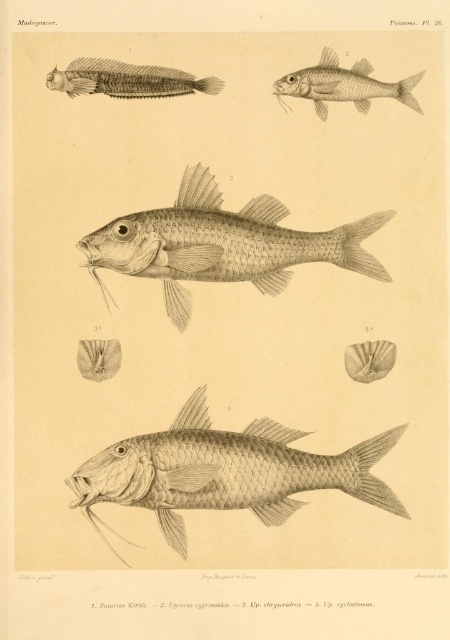
Question: Does grayish matte fish at center appear on the right side of grayish-silver fish at upper left?

Choices:
 (A) yes
 (B) no

Answer: (A)

Question: Which is farther from the grayish-silver fish at upper left?

Choices:
 (A) grayish matte fish at center
 (B) gray textured fish at center
 (C) grayish silver fish at upper center

Answer: (B)

Question: Which of these objects is positioned closest to the grayish silver fish at upper center?

Choices:
 (A) grayish-silver fish at upper left
 (B) grayish matte fish at center
 (C) gray textured fish at center

Answer: (A)

Question: Does gray textured fish at center have a larger size compared to grayish-silver fish at upper left?

Choices:
 (A) no
 (B) yes

Answer: (B)

Question: Based on their relative distances, which object is nearer to the grayish silver fish at upper center?

Choices:
 (A) gray textured fish at center
 (B) grayish matte fish at center
 (C) grayish-silver fish at upper left

Answer: (C)

Question: Does gray textured fish at center appear over grayish matte fish at center?

Choices:
 (A) no
 (B) yes

Answer: (A)